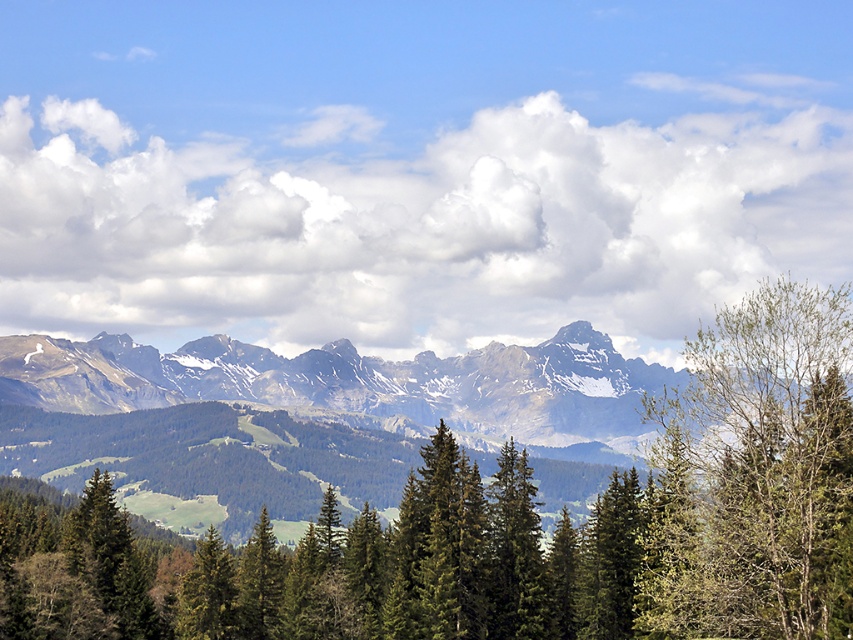
Question: Which point appears farthest from the camera in this image?

Choices:
 (A) (386, 378)
 (B) (190, 632)

Answer: (A)

Question: Where is green matte tree at lower left located in relation to green matte tree at lower center in the image?

Choices:
 (A) above
 (B) below

Answer: (B)

Question: Is green leafy tree at upper right thinner than green matte tree at lower center?

Choices:
 (A) no
 (B) yes

Answer: (A)

Question: In this image, where is green leafy tree at upper right located relative to green matte tree at lower center?

Choices:
 (A) below
 (B) above

Answer: (B)

Question: Which object appears closest to the camera in this image?

Choices:
 (A) green matte tree at lower left
 (B) green leafy tree at upper right
 (C) green matte tree at lower center
 (D) gray rocky mountain range at center

Answer: (B)

Question: Which object is the closest to the green leafy tree at upper right?

Choices:
 (A) green matte tree at lower left
 (B) gray rocky mountain range at center
 (C) green matte tree at lower center

Answer: (C)